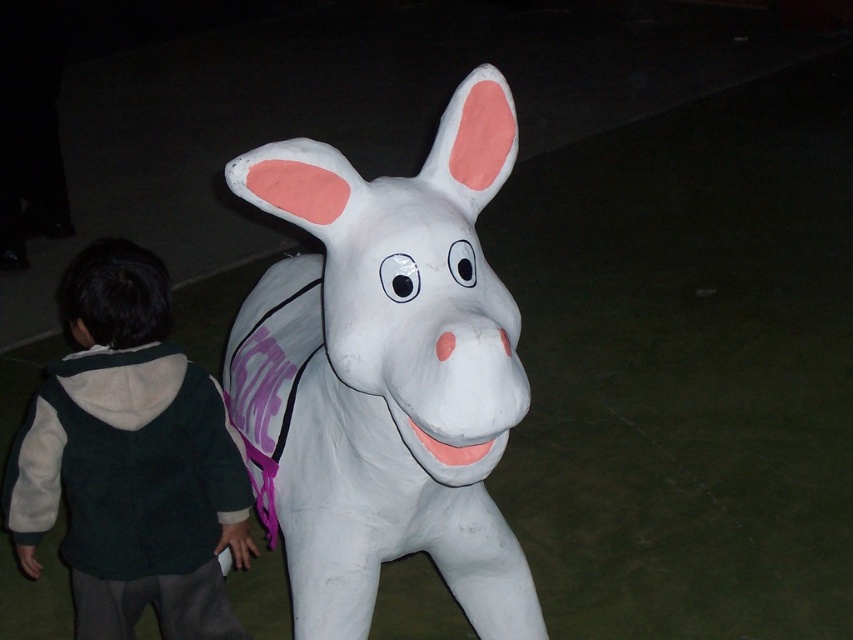
Question: Which point is farther to the camera?

Choices:
 (A) (102, 464)
 (B) (329, 547)

Answer: (A)

Question: Is white matte donkey at center wider than dark green fleece jacket at lower left?

Choices:
 (A) yes
 (B) no

Answer: (A)

Question: Does white matte donkey at center have a lesser width compared to dark green fleece jacket at lower left?

Choices:
 (A) yes
 (B) no

Answer: (B)

Question: Is white matte donkey at center below dark green fleece jacket at lower left?

Choices:
 (A) no
 (B) yes

Answer: (A)